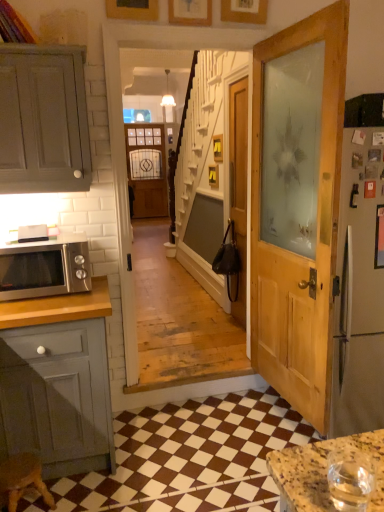
Question: Looking at their shapes, would you say wooden door at center is wider or thinner than wooden picture frame at upper center, the 1th picture frame viewed from the left?

Choices:
 (A) thin
 (B) wide

Answer: (B)

Question: From a real-world perspective, relative to wooden picture frame at upper center, the 1th picture frame viewed from the left, is wooden door at center vertically above or below?

Choices:
 (A) above
 (B) below

Answer: (B)

Question: Which object is the farthest from the matte wooden screen door at center?

Choices:
 (A) matte gray cabinet at left
 (B) wooden picture frame at upper center, which is counted as the second picture frame, starting from the right
 (C) satin silver microwave at left
 (D) wooden door at center
 (E) brown checkered tile at lower center

Answer: (E)

Question: Which object is positioned farthest from the matte gray cabinet at left?

Choices:
 (A) brown wooden stool at lower left
 (B) wooden picture frame at upper center, the 1th picture frame viewed from the left
 (C) wooden picture frame at upper center, marked as the 2th picture frame in a left-to-right arrangement
 (D) matte wooden screen door at center
 (E) brown checkered tile at lower center

Answer: (D)